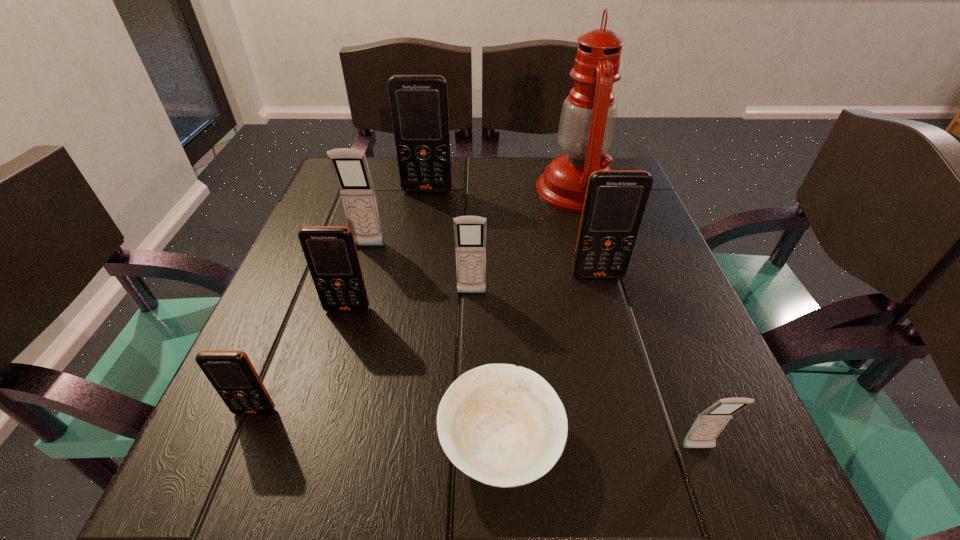
Locate an element on the screen. The image size is (960, 540). the third farthest orange cellular telephone is located at coordinates (330, 251).

Locate an element on the screen. The width and height of the screenshot is (960, 540). the leftmost object is located at coordinates (231, 373).

I want to click on the smallest orange cellular telephone, so click(231, 373).

This screenshot has width=960, height=540. I want to click on the smallest gray cellular telephone, so click(709, 424).

This screenshot has height=540, width=960. In order to click on the nearest gray cellular telephone in this screenshot , I will do `click(709, 424)`.

Find the location of a particular element. This screenshot has width=960, height=540. bowl is located at coordinates (503, 425).

Where is `beige bowl`? beige bowl is located at coordinates (503, 425).

The width and height of the screenshot is (960, 540). I want to click on free space located 0.210m on the left of the oil lamp, so click(x=449, y=190).

Where is `free space located on the screen of the second orange cellular telephone from right to left`? The width and height of the screenshot is (960, 540). free space located on the screen of the second orange cellular telephone from right to left is located at coordinates (417, 256).

The image size is (960, 540). I want to click on free spot located 0.210m on the front-facing side of the third farthest object, so click(x=344, y=330).